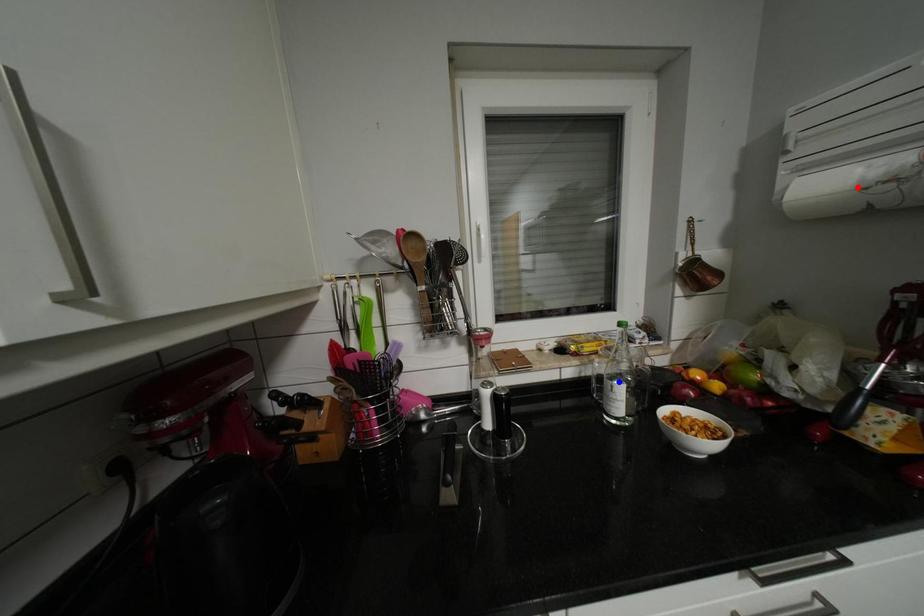
Question: In the image, two points are highlighted. Which point is nearer to the camera? Reply with the corresponding letter.

Choices:
 (A) blue point
 (B) red point

Answer: (B)